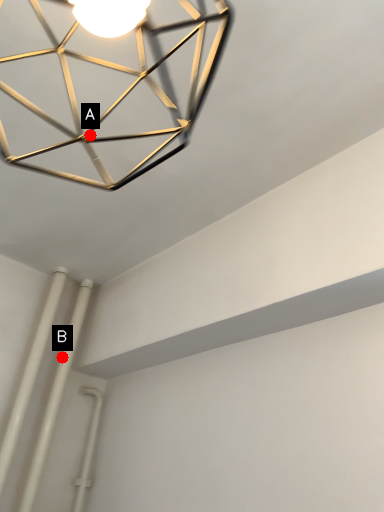
Question: Two points are circled on the image, labeled by A and B beside each circle. Which point is closer to the camera taking this photo?

Choices:
 (A) A is closer
 (B) B is closer

Answer: (A)